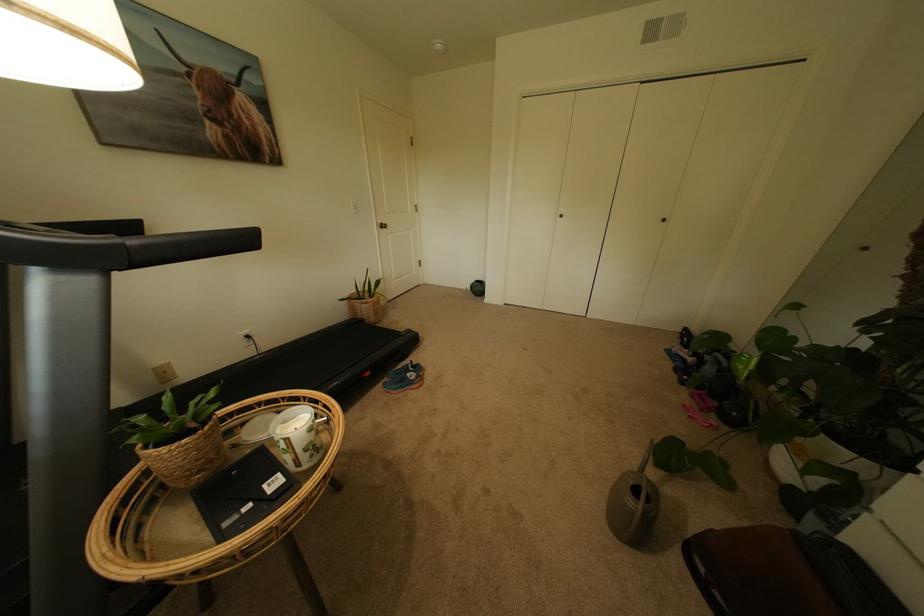
This screenshot has width=924, height=616. Describe the element at coordinates (366, 308) in the screenshot. I see `the wicker plant pot` at that location.